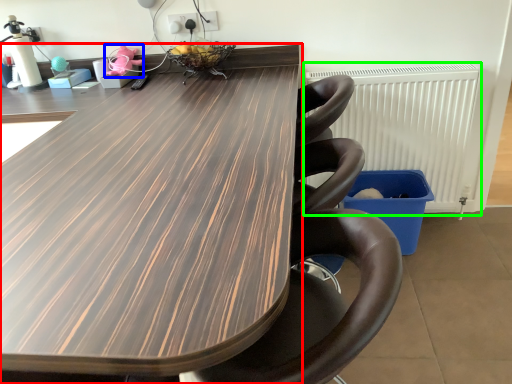
Question: Which is farther away from table (highlighted by a red box)? toy (highlighted by a blue box) or radiator (highlighted by a green box)?

Choices:
 (A) toy
 (B) radiator

Answer: (A)